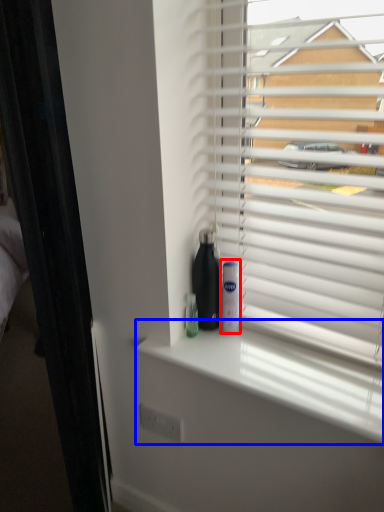
Question: Which object appears closest to the camera in this image, mouthwash (highlighted by a red box) or window sill (highlighted by a blue box)?

Choices:
 (A) mouthwash
 (B) window sill

Answer: (B)